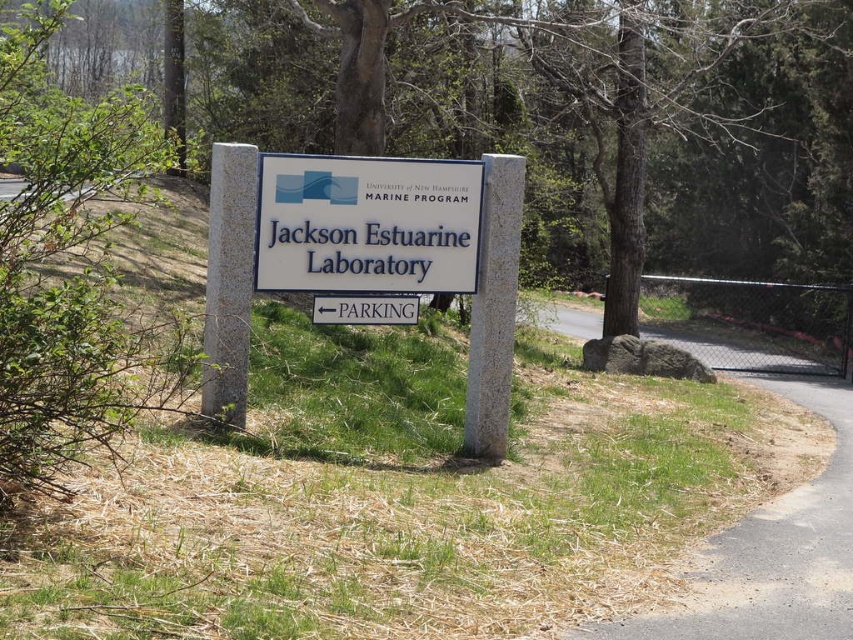
Question: Is asphalt road at lower right to the left of white plastic sign at center from the viewer's perspective?

Choices:
 (A) no
 (B) yes

Answer: (A)

Question: Which object appears closest to the camera in this image?

Choices:
 (A) asphalt road at lower right
 (B) white plastic sign at center

Answer: (A)

Question: Where is asphalt road at lower right located in relation to white plastic sign at center in the image?

Choices:
 (A) right
 (B) left

Answer: (A)

Question: Is asphalt road at lower right above white plastic sign at center?

Choices:
 (A) no
 (B) yes

Answer: (A)

Question: Which point appears farthest from the camera in this image?

Choices:
 (A) (837, 404)
 (B) (479, 232)

Answer: (A)